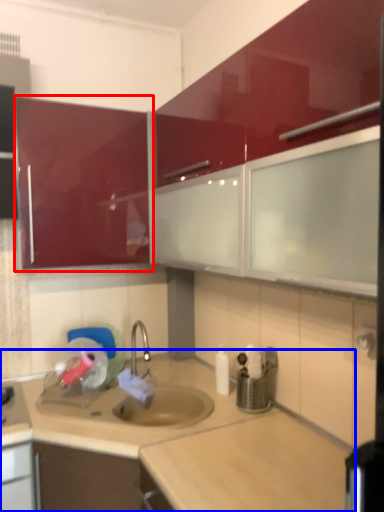
Question: Which point is closer to the camera, cabinetry (highlighted by a red box) or countertop (highlighted by a blue box)?

Choices:
 (A) cabinetry
 (B) countertop

Answer: (B)